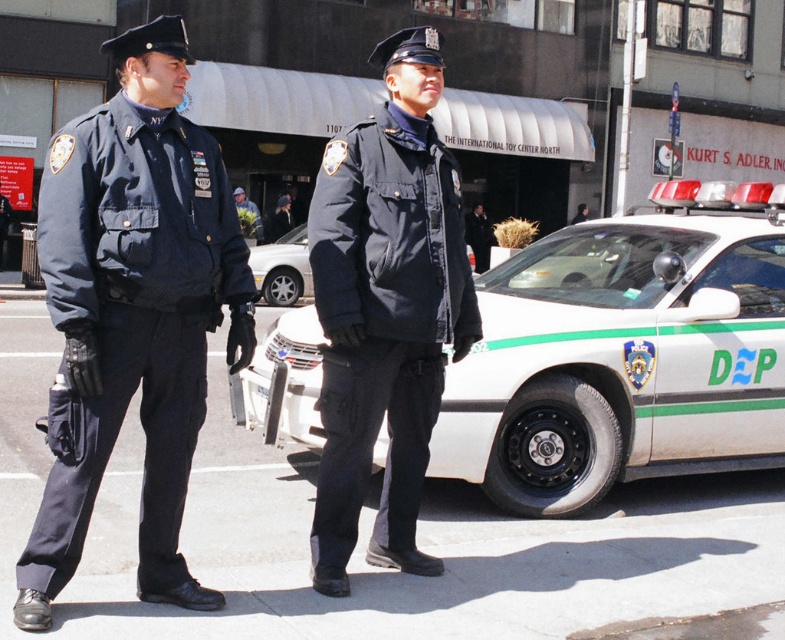
You are a delivery person who needs to place a package between the black matte uniform at center and the green leafy bouquet at center. The package requires a minimum of 15 feet of space. Can you fit the package there?

The distance between the black matte uniform at center and the green leafy bouquet at center is 18.00 feet, which is more than the required 15 feet. Therefore, the package can be placed there with sufficient space.

You are a pedestrian passing by the scene. You notice the navy blue fabric uniform at left and the green leafy bouquet at center. Which object is taller?

The navy blue fabric uniform at left is taller than the green leafy bouquet at center.